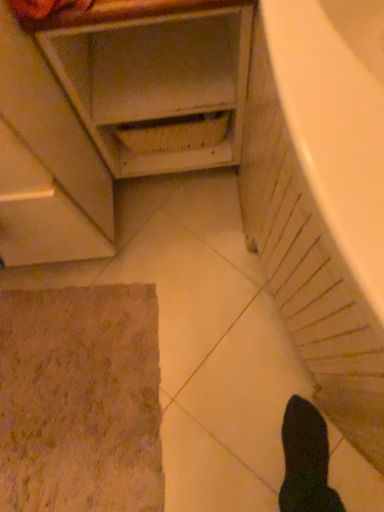
Question: Is matte white cabinet at upper left oriented away from brown textured bath mat at lower left?

Choices:
 (A) yes
 (B) no

Answer: (B)

Question: Does matte white cabinet at upper left have a lesser height compared to brown textured bath mat at lower left?

Choices:
 (A) no
 (B) yes

Answer: (A)

Question: Is matte white cabinet at upper left to the left of brown textured bath mat at lower left from the viewer's perspective?

Choices:
 (A) no
 (B) yes

Answer: (A)

Question: Is matte white cabinet at upper left behind brown textured bath mat at lower left?

Choices:
 (A) yes
 (B) no

Answer: (B)

Question: From the image's perspective, is matte white cabinet at upper left above brown textured bath mat at lower left?

Choices:
 (A) no
 (B) yes

Answer: (B)

Question: From a real-world perspective, is white glossy bathtub at lower right positioned above or below brown textured bath mat at lower left?

Choices:
 (A) below
 (B) above

Answer: (B)

Question: In terms of height, does white glossy bathtub at lower right look taller or shorter compared to brown textured bath mat at lower left?

Choices:
 (A) tall
 (B) short

Answer: (A)

Question: Based on their positions, is white glossy bathtub at lower right located to the left or right of brown textured bath mat at lower left?

Choices:
 (A) right
 (B) left

Answer: (A)

Question: From the image's perspective, is white glossy bathtub at lower right located above or below brown textured bath mat at lower left?

Choices:
 (A) below
 (B) above

Answer: (B)

Question: Considering the positions of white glossy bathtub at lower right and matte white cabinet at upper left in the image, is white glossy bathtub at lower right bigger or smaller than matte white cabinet at upper left?

Choices:
 (A) small
 (B) big

Answer: (B)

Question: From a real-world perspective, is white glossy bathtub at lower right positioned above or below matte white cabinet at upper left?

Choices:
 (A) below
 (B) above

Answer: (B)

Question: Is white glossy bathtub at lower right wider or thinner than matte white cabinet at upper left?

Choices:
 (A) wide
 (B) thin

Answer: (A)

Question: Visually, is white glossy bathtub at lower right positioned to the left or to the right of matte white cabinet at upper left?

Choices:
 (A) left
 (B) right

Answer: (B)

Question: Considering the positions of brown textured bath mat at lower left and matte white cabinet at upper left in the image, is brown textured bath mat at lower left taller or shorter than matte white cabinet at upper left?

Choices:
 (A) short
 (B) tall

Answer: (A)

Question: Looking at the image, does brown textured bath mat at lower left seem bigger or smaller compared to matte white cabinet at upper left?

Choices:
 (A) small
 (B) big

Answer: (A)